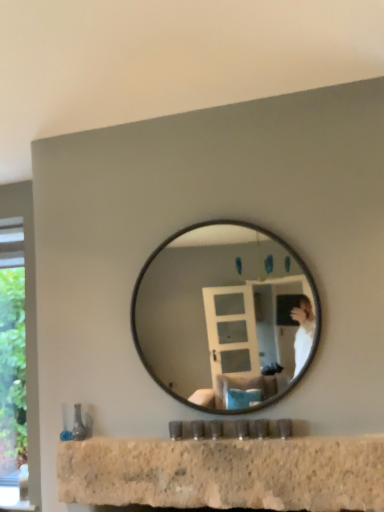
Question: Considering their positions, is black glass mirror at center located in front of or behind granite countertop at lower center?

Choices:
 (A) behind
 (B) front

Answer: (A)

Question: From the image's perspective, is black glass mirror at center positioned above or below granite countertop at lower center?

Choices:
 (A) above
 (B) below

Answer: (A)

Question: Is black glass mirror at center inside the boundaries of granite countertop at lower center, or outside?

Choices:
 (A) outside
 (B) inside

Answer: (A)

Question: Based on their sizes in the image, would you say granite countertop at lower center is bigger or smaller than black glass mirror at center?

Choices:
 (A) big
 (B) small

Answer: (B)

Question: Relative to black glass mirror at center, is granite countertop at lower center in front or behind?

Choices:
 (A) behind
 (B) front

Answer: (B)

Question: In terms of width, does granite countertop at lower center look wider or thinner when compared to black glass mirror at center?

Choices:
 (A) thin
 (B) wide

Answer: (A)

Question: Is point (264, 456) closer or farther from the camera than point (206, 251)?

Choices:
 (A) closer
 (B) farther

Answer: (A)